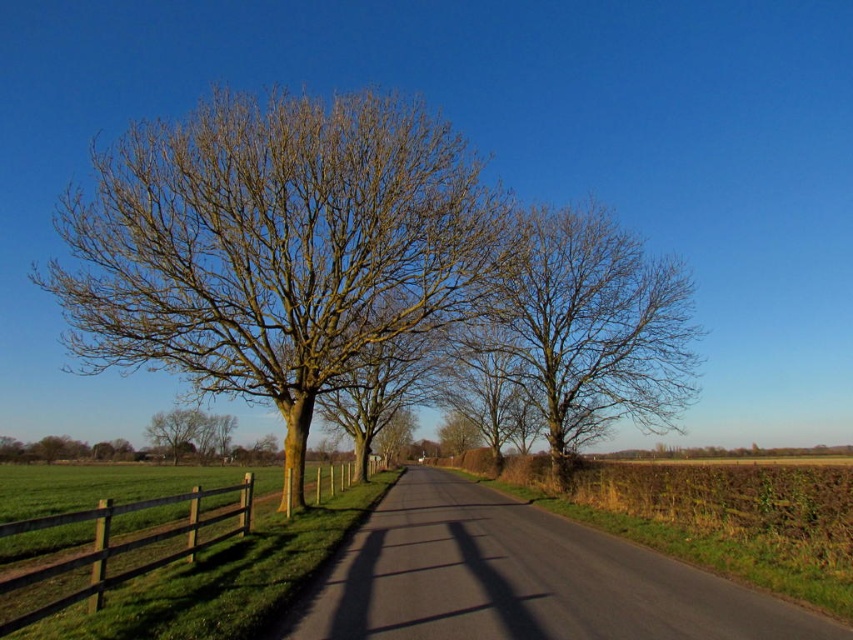
Does point (202, 378) lie in front of point (421, 401)?

That is True.

Is green mossy tree at center to the left of brown rough bark tree at center from the viewer's perspective?

Indeed, green mossy tree at center is positioned on the left side of brown rough bark tree at center.

Between point (169, 276) and point (325, 406), which one is positioned behind?

Point (325, 406)

Find the location of `green mossy tree at center`. green mossy tree at center is located at coordinates (276, 246).

This screenshot has width=853, height=640. What do you see at coordinates (585, 328) in the screenshot?
I see `bare wood tree at center` at bounding box center [585, 328].

At what (x,y) coordinates should I click in order to perform the action: click on bare wood tree at center. Please return your answer as a coordinate pair (x, y). The height and width of the screenshot is (640, 853). Looking at the image, I should click on (585, 328).

Can you confirm if bare wood tree at center is positioned below brown wooden fence at lower left?

No, bare wood tree at center is not below brown wooden fence at lower left.

Is point (683, 362) in front of point (180, 550)?

No, (683, 362) is behind (180, 550).

You are a GUI agent. You are given a task and a screenshot of the screen. Output one action in this format:
    pyautogui.click(x=<x>, y=<y>)
    Task: Click on the bare wood tree at center
    This screenshot has width=853, height=640.
    Given the screenshot: What is the action you would take?
    pyautogui.click(x=585, y=328)